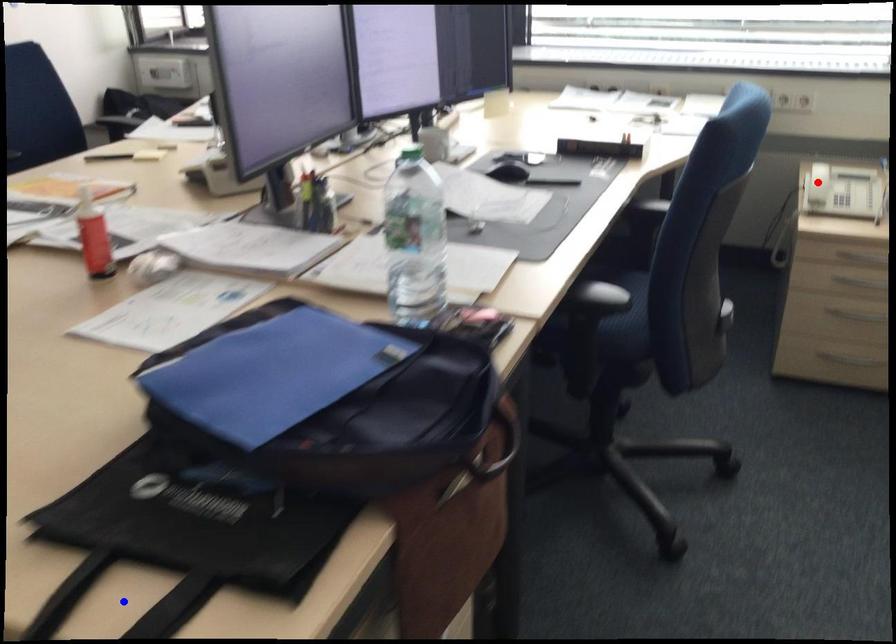
Question: Two points are marked on the image. Which point is closer to the camera?

Choices:
 (A) Blue point is closer.
 (B) Red point is closer.

Answer: (A)